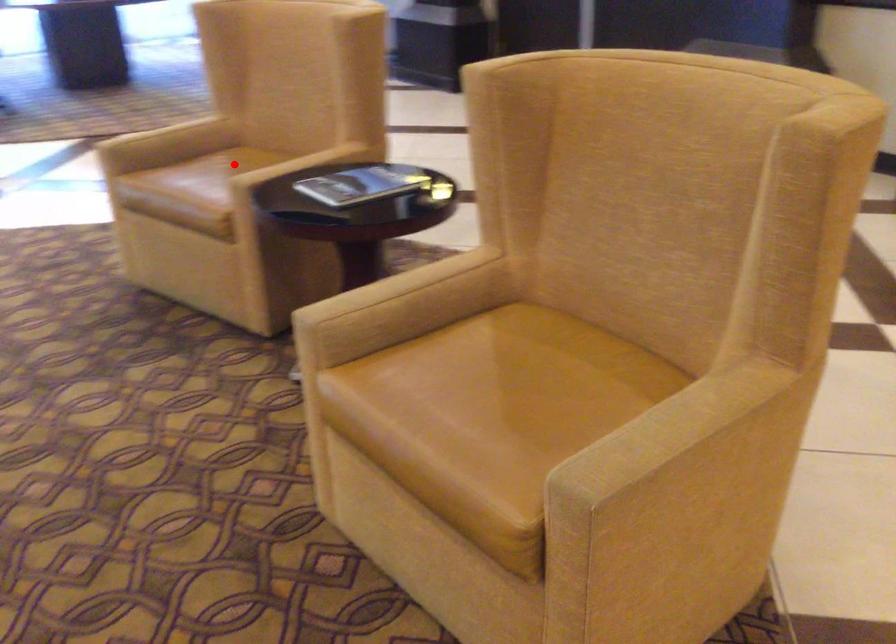
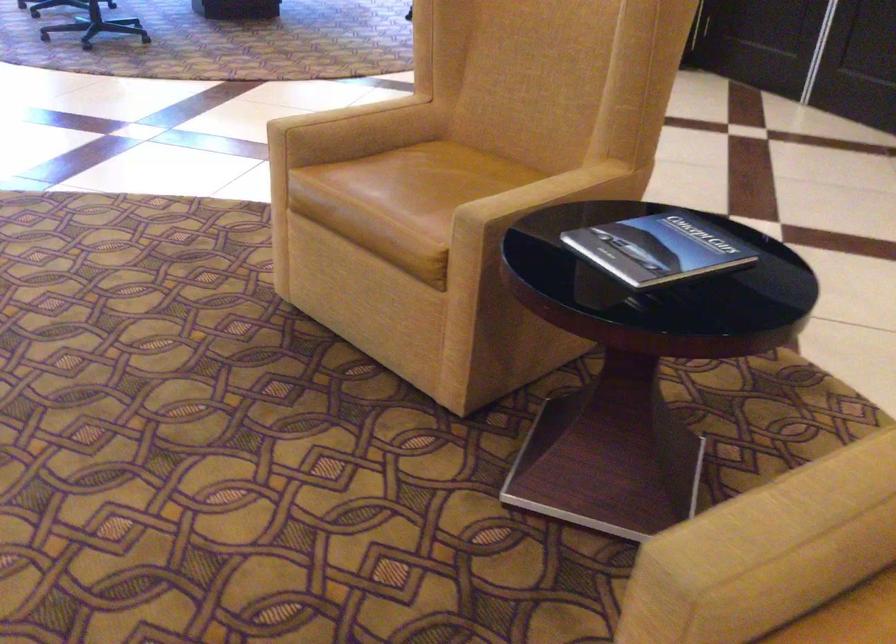
Find the pixel in the second image that matches the highlighted location in the first image.

(440, 174)